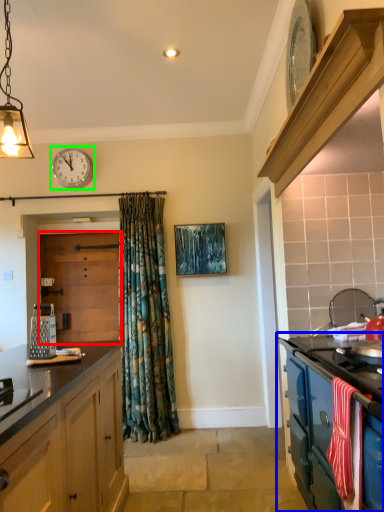
Question: Based on their relative distances, which object is farther from door (highlighted by a red box)? Choose from cabinetry (highlighted by a blue box) and clock (highlighted by a green box).

Choices:
 (A) cabinetry
 (B) clock

Answer: (A)